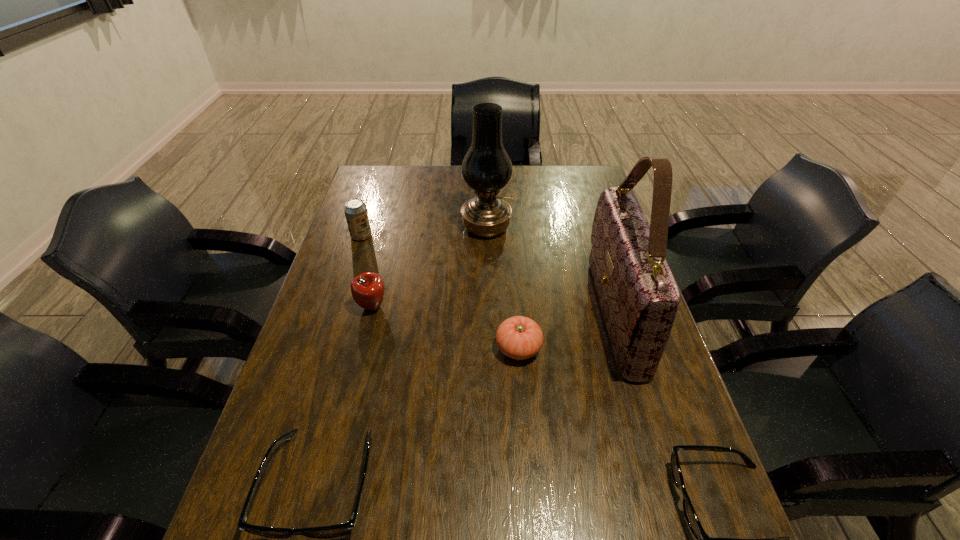
In order to click on vacant space situated 0.230m on the front of the handbag with the clasp in this screenshot , I will do `click(510, 314)`.

What are the coordinates of `free space located on the front of the handbag with the clasp` in the screenshot? It's located at (572, 314).

I want to click on beer can positioned at the left edge, so click(x=355, y=210).

Where is `apple at the left edge`? This screenshot has width=960, height=540. apple at the left edge is located at coordinates (367, 289).

Locate an element on the screen. This screenshot has width=960, height=540. object at the right edge is located at coordinates point(638,295).

Identify the location of free space at the far edge. Image resolution: width=960 pixels, height=540 pixels. (420, 178).

Where is `free space at the near edge of the desktop`? free space at the near edge of the desktop is located at coordinates (391, 469).

Where is `vacant space at the left edge of the desktop`? vacant space at the left edge of the desktop is located at coordinates (337, 343).

This screenshot has height=540, width=960. In order to click on free space at the right edge of the desktop in this screenshot , I will do `click(597, 329)`.

At what (x,y) coordinates should I click in order to perform the action: click on blank area at the far left corner. Please return your answer as a coordinate pair (x, y). The width and height of the screenshot is (960, 540). Looking at the image, I should click on (399, 173).